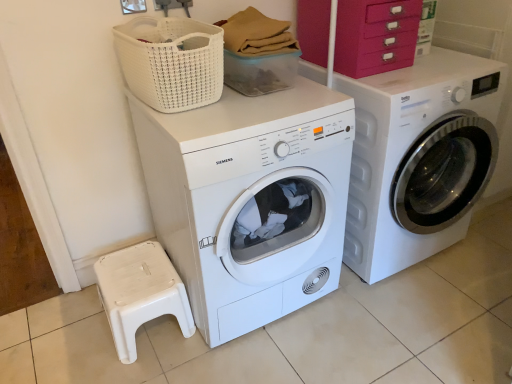
Question: From the image's perspective, is white matte washing machine at center, which is the 1th washing machine from left to right, under white glossy washing machine at right, which appears as the 1th washing machine when viewed from the right?

Choices:
 (A) yes
 (B) no

Answer: (A)

Question: Does white matte washing machine at center, which is the 1th washing machine from left to right, come behind white glossy washing machine at right, the 2th washing machine from the left?

Choices:
 (A) yes
 (B) no

Answer: (B)

Question: Can you confirm if white matte washing machine at center, which is counted as the second washing machine, starting from the right, is shorter than white glossy washing machine at right, the 2th washing machine from the left?

Choices:
 (A) yes
 (B) no

Answer: (B)

Question: Is white matte washing machine at center, which is counted as the second washing machine, starting from the right, to the right of white glossy washing machine at right, which appears as the 1th washing machine when viewed from the right, from the viewer's perspective?

Choices:
 (A) no
 (B) yes

Answer: (A)

Question: Is white matte washing machine at center, which is counted as the second washing machine, starting from the right, facing away from white glossy washing machine at right, which appears as the 1th washing machine when viewed from the right?

Choices:
 (A) yes
 (B) no

Answer: (B)

Question: Is white matte washing machine at center, which is counted as the second washing machine, starting from the right, positioned far away from white glossy washing machine at right, the 2th washing machine from the left?

Choices:
 (A) no
 (B) yes

Answer: (A)

Question: From a real-world perspective, is white woven basket at upper center on white glossy washing machine at right, the 2th washing machine from the left?

Choices:
 (A) yes
 (B) no

Answer: (A)

Question: Can you confirm if white woven basket at upper center is bigger than white glossy washing machine at right, the 2th washing machine from the left?

Choices:
 (A) no
 (B) yes

Answer: (A)

Question: Considering the relative sizes of white woven basket at upper center and white glossy washing machine at right, the 2th washing machine from the left, in the image provided, is white woven basket at upper center shorter than white glossy washing machine at right, the 2th washing machine from the left,?

Choices:
 (A) yes
 (B) no

Answer: (A)

Question: From the image's perspective, is white woven basket at upper center below white glossy washing machine at right, which appears as the 1th washing machine when viewed from the right?

Choices:
 (A) yes
 (B) no

Answer: (B)

Question: Is white glossy washing machine at right, which appears as the 1th washing machine when viewed from the right, surrounded by white woven basket at upper center?

Choices:
 (A) no
 (B) yes

Answer: (A)

Question: From a real-world perspective, does white woven basket at upper center sit lower than white glossy washing machine at right, which appears as the 1th washing machine when viewed from the right?

Choices:
 (A) yes
 (B) no

Answer: (B)

Question: From a real-world perspective, is white plastic step stool at lower left positioned under pink plastic drawers at upper right based on gravity?

Choices:
 (A) yes
 (B) no

Answer: (A)